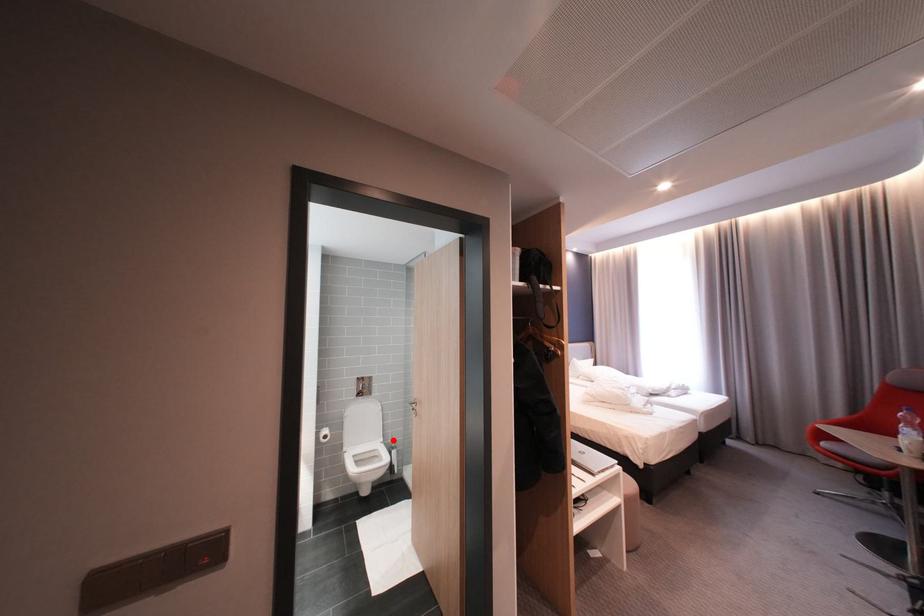
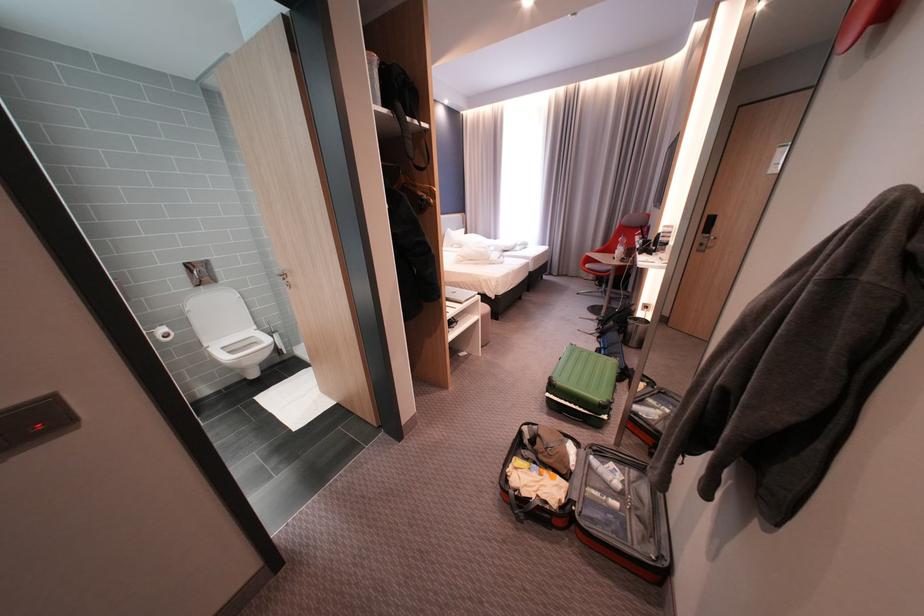
Find the pixel in the second image that matches the highlighted location in the first image.

(266, 328)